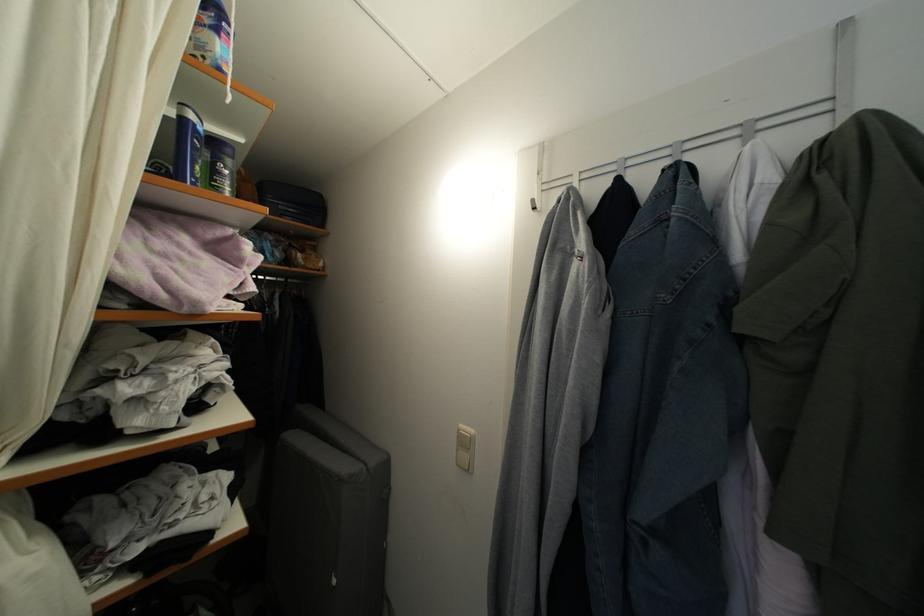
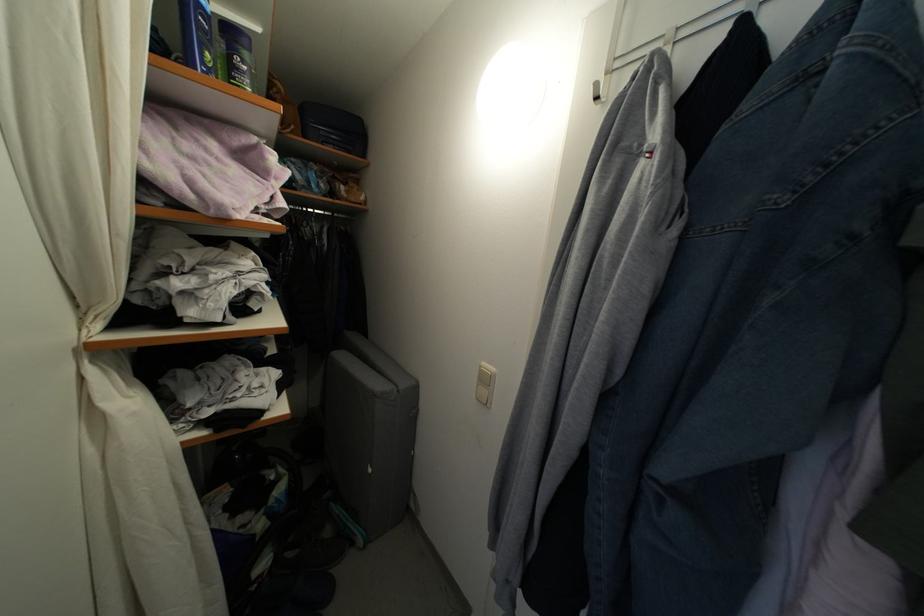
Question: The first image is from the beginning of the video and the second image is from the end. How did the camera likely rotate when shooting the video?

Choices:
 (A) Left
 (B) Right
 (C) Up
 (D) Down

Answer: (D)